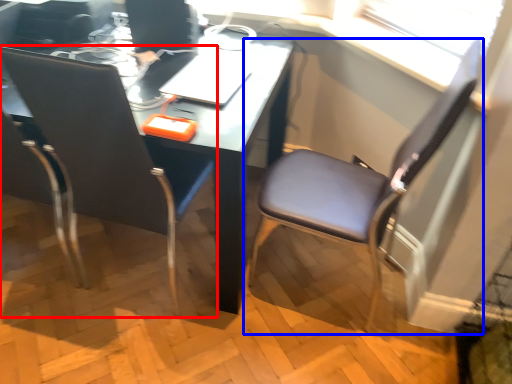
Question: Which point is closer to the camera, chair (highlighted by a red box) or chair (highlighted by a blue box)?

Choices:
 (A) chair
 (B) chair

Answer: (A)